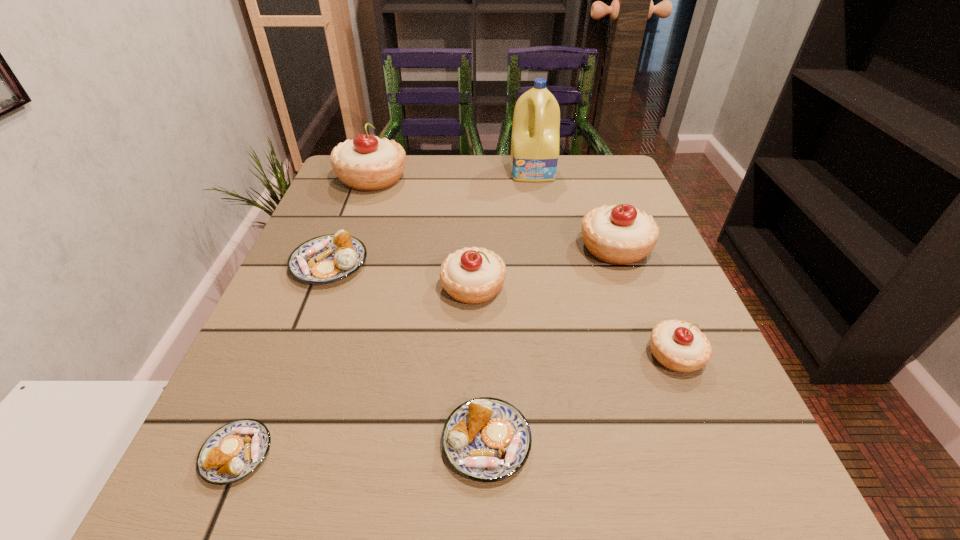
This screenshot has height=540, width=960. What are the coordinates of `vacant area situated 0.130m on the left of the nearest beige pastry` in the screenshot? It's located at (566, 355).

This screenshot has width=960, height=540. I want to click on free location located 0.170m on the right of the third shortest object, so click(453, 264).

Identify the location of free location located on the back of the second biggest brown pastry. Image resolution: width=960 pixels, height=540 pixels. (485, 265).

Where is `free point located on the right of the smallest brown pastry`? free point located on the right of the smallest brown pastry is located at coordinates (415, 454).

Image resolution: width=960 pixels, height=540 pixels. I want to click on detergent present at the far edge, so click(535, 138).

You are a GUI agent. You are given a task and a screenshot of the screen. Output one action in this format:
    pyautogui.click(x=<x>, y=<y>)
    Task: Click on the pastry located at the far edge
    
    Given the screenshot: What is the action you would take?
    pyautogui.click(x=367, y=163)

What are the coordinates of `object that is at the far left corner` in the screenshot? It's located at (367, 163).

Where is `object that is at the near left corner`? This screenshot has height=540, width=960. object that is at the near left corner is located at coordinates (232, 452).

The image size is (960, 540). What are the coordinates of `vacant space at the far edge of the desktop` in the screenshot? It's located at (461, 184).

This screenshot has width=960, height=540. Identify the location of vacant space at the near edge of the desktop. (401, 498).